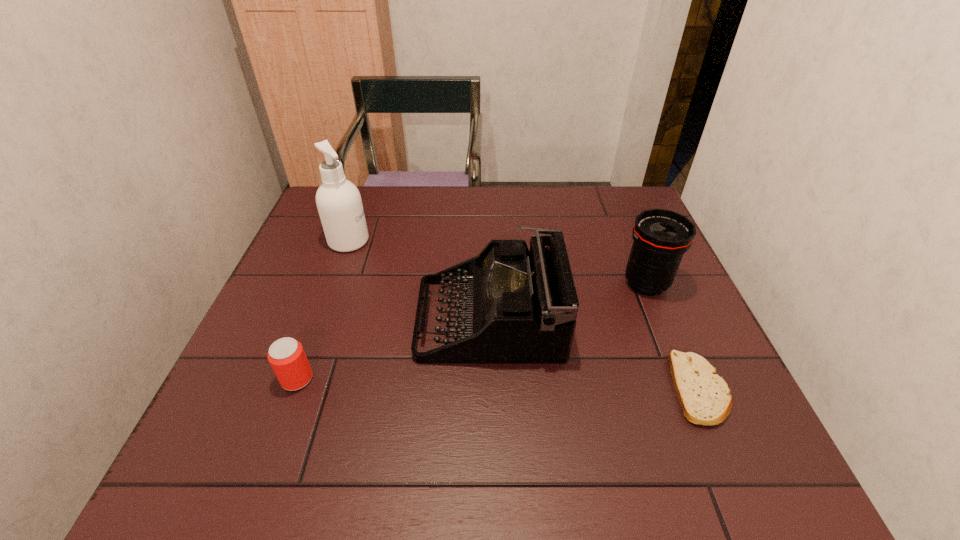
The height and width of the screenshot is (540, 960). I want to click on vacant space that satisfies the following two spatial constraints: 1. on the typing side of the typewriter; 2. on the right side of the shortest object, so click(491, 389).

Find the location of `free space that satisfies the following two spatial constraints: 1. on the front side of the telephoto lens; 2. on the typing side of the typewriter`. free space that satisfies the following two spatial constraints: 1. on the front side of the telephoto lens; 2. on the typing side of the typewriter is located at coordinates (660, 318).

What are the coordinates of `vacant space that satisfies the following two spatial constraints: 1. on the front label of the farthest object; 2. on the left side of the telephoto lens` in the screenshot? It's located at (333, 284).

The image size is (960, 540). Identify the location of free point that satisfies the following two spatial constraints: 1. on the typing side of the shortest object; 2. on the right side of the typewriter. (491, 389).

You are a GUI agent. You are given a task and a screenshot of the screen. Output one action in this format:
    pyautogui.click(x=<x>, y=<y>)
    Task: Click on the blank area in the image that satisfies the following two spatial constraints: 1. on the front label of the cleansing agent; 2. on the right side of the pita bread
    The image size is (960, 540).
    Given the screenshot: What is the action you would take?
    pyautogui.click(x=296, y=389)

Find the location of a particular element. This screenshot has width=960, height=540. free space that satisfies the following two spatial constraints: 1. on the front side of the beer can; 2. on the left side of the shortest object is located at coordinates (294, 389).

What are the coordinates of `free space that satisfies the following two spatial constraints: 1. on the front label of the telephoto lens; 2. on the left side of the tallest object` in the screenshot? It's located at (333, 284).

Locate an element on the screen. Image resolution: width=960 pixels, height=540 pixels. vacant position in the image that satisfies the following two spatial constraints: 1. on the front label of the pita bread; 2. on the left side of the cleansing agent is located at coordinates (296, 389).